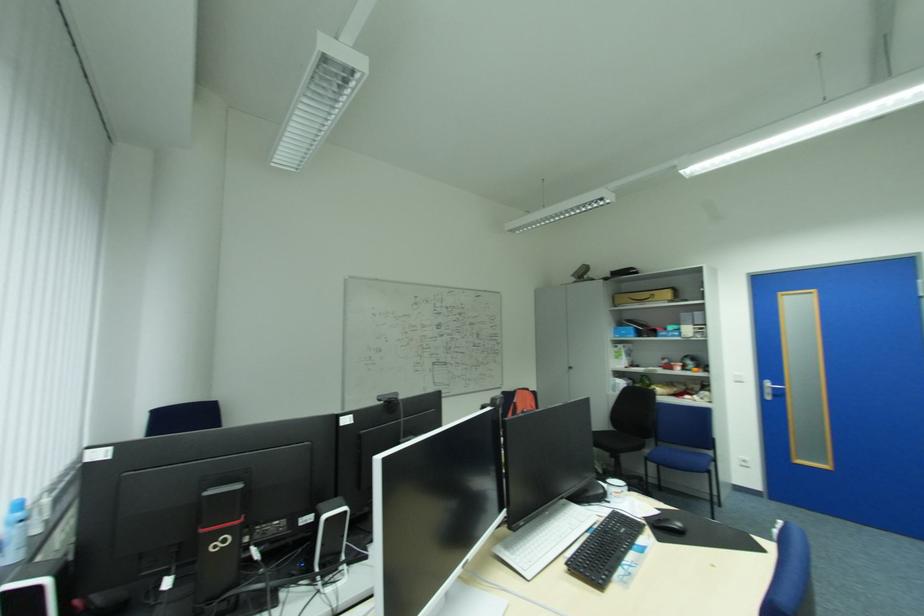
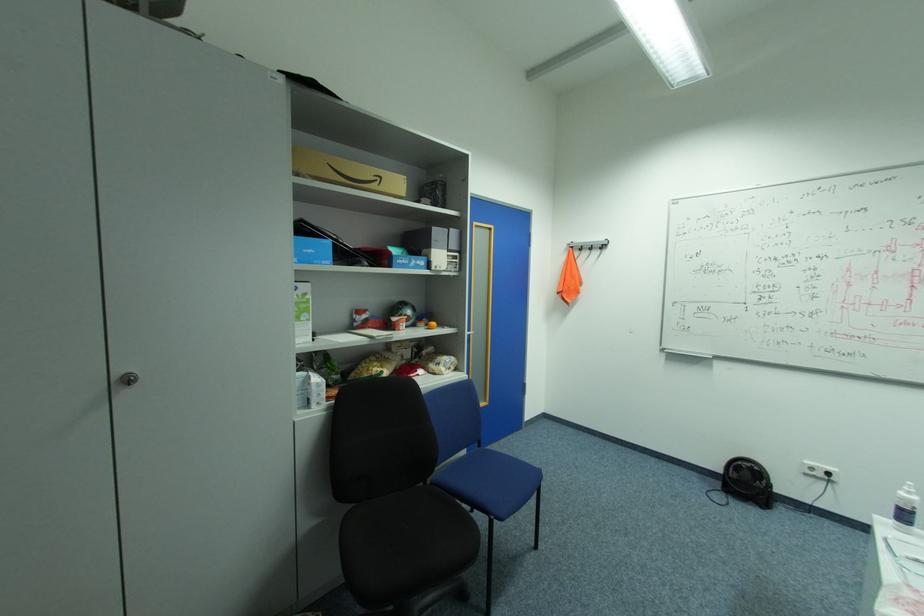
In the second image, find the point that corresponds to (623,384) in the first image.

(321, 387)